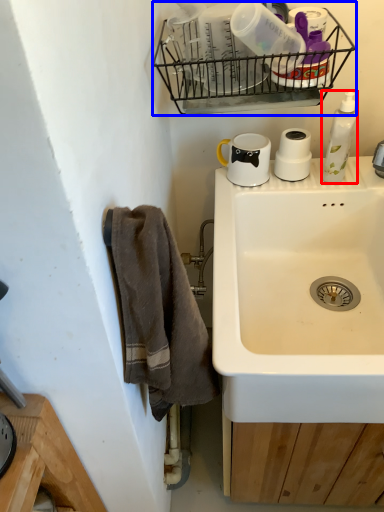
Question: Among these objects, which one is nearest to the camera, cleaning product (highlighted by a red box) or basket (highlighted by a blue box)?

Choices:
 (A) cleaning product
 (B) basket

Answer: (B)